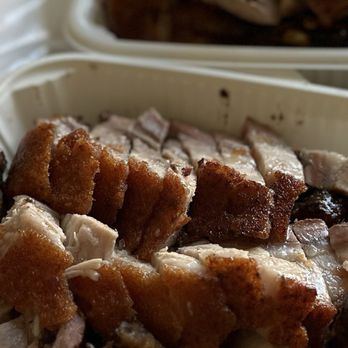
The height and width of the screenshot is (348, 348). What are the coordinates of `stains on inside tray` in the screenshot? It's located at (227, 90), (271, 116), (278, 115), (301, 122).